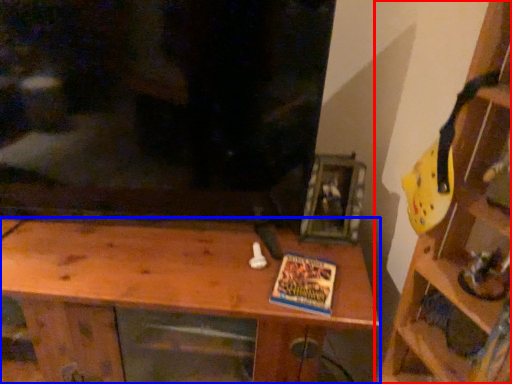
Question: Which object is closer to the camera taking this photo, shelf (highlighted by a red box) or shelf (highlighted by a blue box)?

Choices:
 (A) shelf
 (B) shelf

Answer: (A)